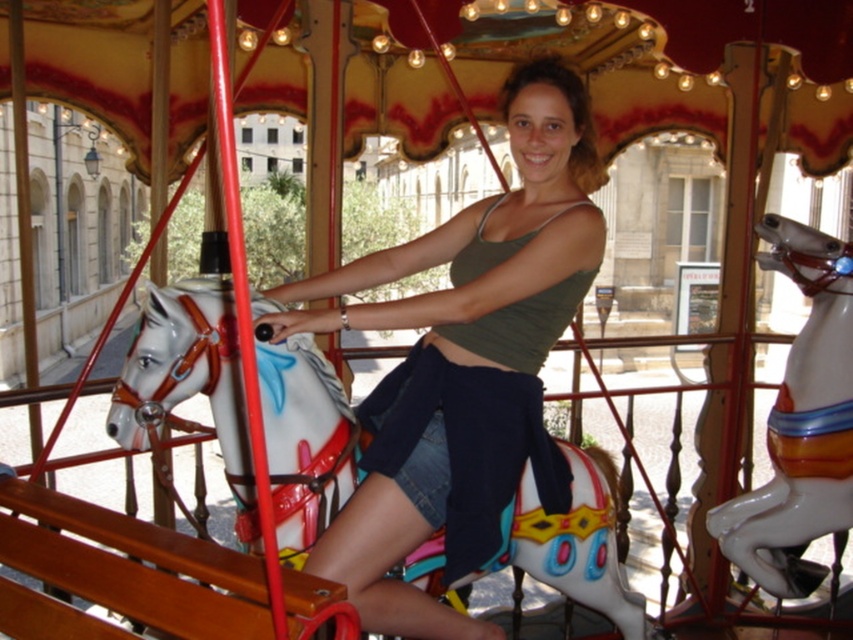
You are standing in front of the carousel and want to take a photo of both the white glossy horse at center and the shiny white horse at center. Which horse should you focus on first to ensure both are in the frame?

You should focus on the white glossy horse at center first because it is in front of the shiny white horse at center, so positioning the camera to include both would require starting with the closer one.

You are standing in front of the carousel and notice two horses, the white glossy horse at center and the shiny white horse at center. Which one is positioned lower in the image?

The white glossy horse at center is positioned lower than the shiny white horse at center.